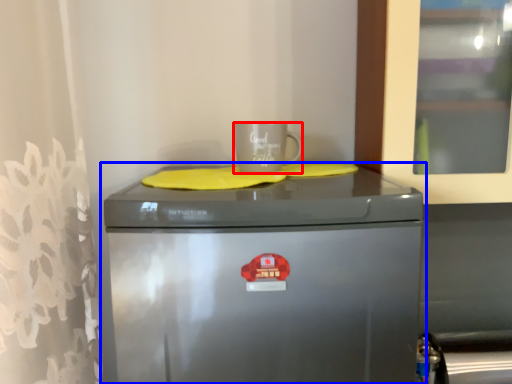
Question: Which point is further to the camera, mug (highlighted by a red box) or home appliance (highlighted by a blue box)?

Choices:
 (A) mug
 (B) home appliance

Answer: (A)